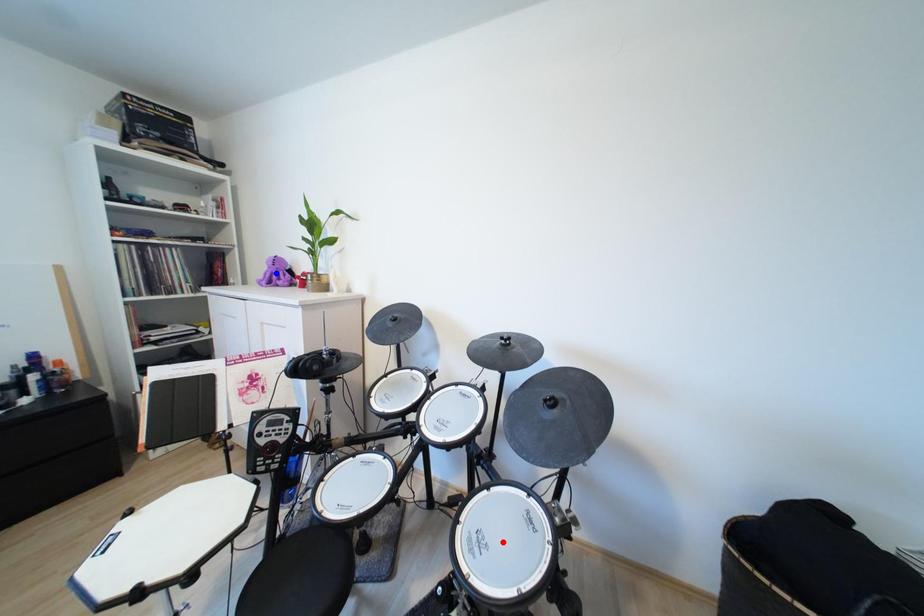
Question: Two points are marked on the image. Which point is closer to the camera?

Choices:
 (A) Blue point is closer.
 (B) Red point is closer.

Answer: (B)